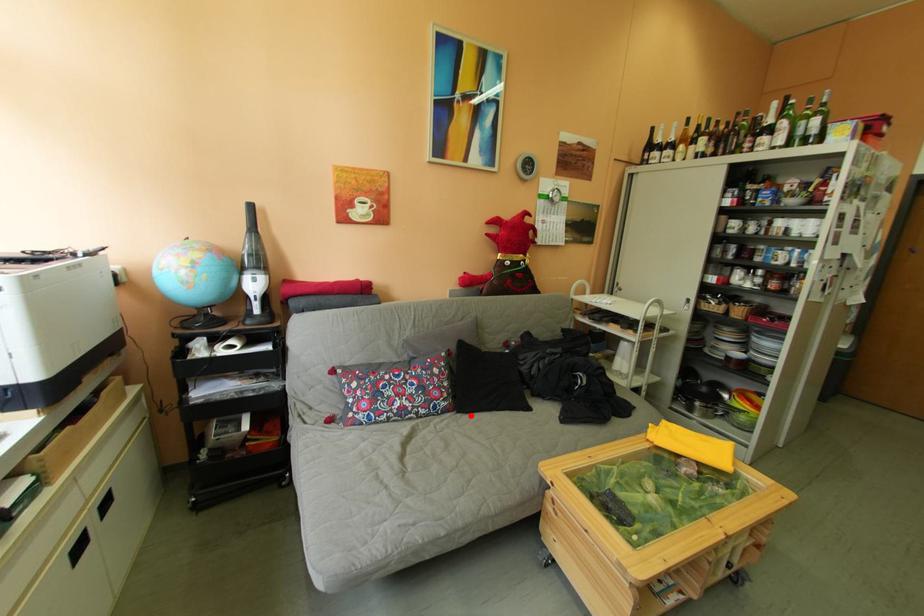
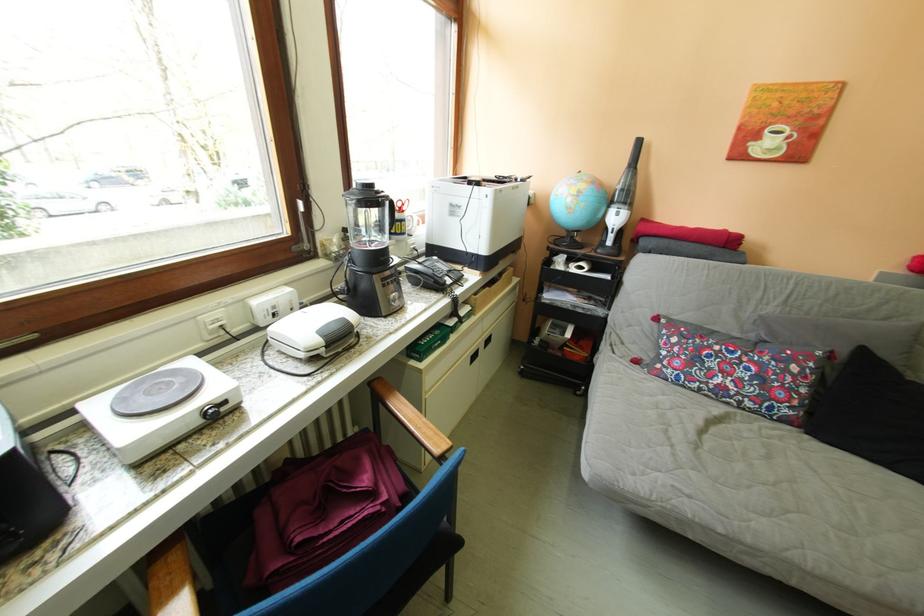
Where in the second image is the point corresponding to the highlighted location from the first image?

(821, 437)